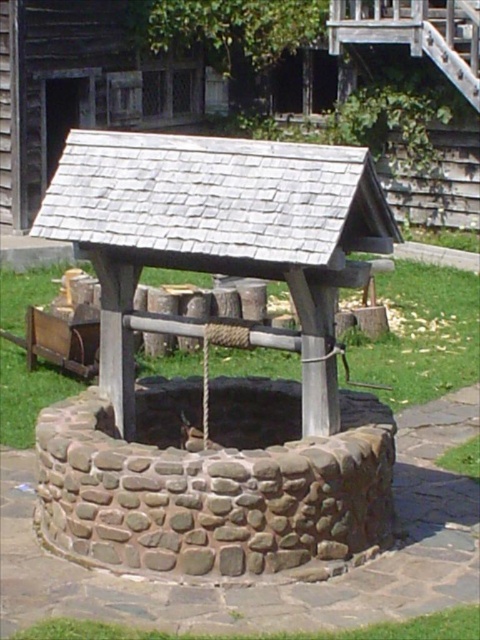
Can you confirm if gray stone well at center is positioned above stone textured well at center?

Actually, gray stone well at center is below stone textured well at center.

From the picture: Is gray stone well at center to the right of stone textured well at center from the viewer's perspective?

Correct, you'll find gray stone well at center to the right of stone textured well at center.

Locate an element on the screen. gray stone well at center is located at coordinates (214, 480).

Where is `gray stone well at center`? The width and height of the screenshot is (480, 640). gray stone well at center is located at coordinates (214, 480).